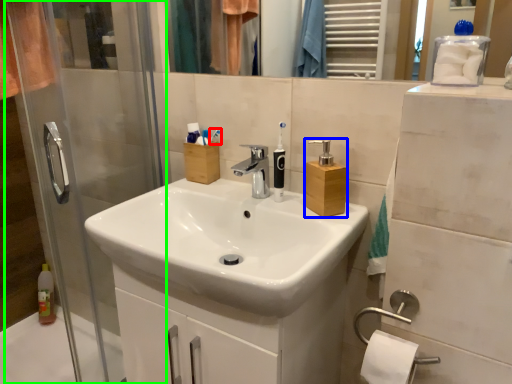
Question: Which object is the farthest from toothbrush (highlighted by a red box)? Choose among these: soap dispenser (highlighted by a blue box) or screen door (highlighted by a green box).

Choices:
 (A) soap dispenser
 (B) screen door

Answer: (B)